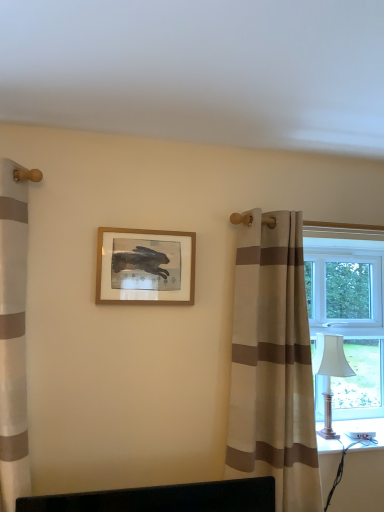
Find the location of a particular element. The image size is (384, 512). wooden picture frame at center is located at coordinates (145, 267).

Describe the element at coordinates (349, 310) in the screenshot. The width and height of the screenshot is (384, 512). I see `white plastic window at right` at that location.

The width and height of the screenshot is (384, 512). What are the coordinates of `wooden picture frame at center` in the screenshot? It's located at (145, 267).

From a real-world perspective, is wooden picture frame at center positioned over beige striped curtain at right based on gravity?

Yes.

From the image's perspective, between wooden picture frame at center and beige striped curtain at right, which one is located above?

wooden picture frame at center.

Which object is more forward, wooden picture frame at center or beige striped curtain at right?

beige striped curtain at right is more forward.

Relative to white plastic window at right, is wooden picture frame at center in front or behind?

In the image, wooden picture frame at center appears in front of white plastic window at right.

Considering the sizes of wooden picture frame at center and white plastic window at right in the image, is wooden picture frame at center bigger or smaller than white plastic window at right?

Clearly, wooden picture frame at center is smaller in size than white plastic window at right.

Considering the relative positions of wooden picture frame at center and white plastic window at right in the image provided, is wooden picture frame at center to the right of white plastic window at right from the viewer's perspective?

Incorrect, wooden picture frame at center is not on the right side of white plastic window at right.

From the image's perspective, which is above, wooden picture frame at center or white plastic window at right?

wooden picture frame at center, from the image's perspective.

Which object is thinner, wooden picture frame at center or silver metallic table lamp at right?

With smaller width is wooden picture frame at center.

Is wooden picture frame at center in front of or behind silver metallic table lamp at right in the image?

Visually, wooden picture frame at center is located in front of silver metallic table lamp at right.

Which of these two, wooden picture frame at center or silver metallic table lamp at right, is smaller?

wooden picture frame at center.

Can you confirm if wooden picture frame at center is positioned to the right of silver metallic table lamp at right?

No, wooden picture frame at center is not to the right of silver metallic table lamp at right.

From the image's perspective, which one is positioned higher, white plastic window at right or wooden picture frame at center?

wooden picture frame at center appears higher in the image.

Identify the location of picture frame above the white plastic window at right (from the image's perspective). (145, 267).

Is white plastic window at right turned away from wooden picture frame at center?

white plastic window at right does not have its back to wooden picture frame at center.

Is white plastic window at right outside of wooden picture frame at center?

white plastic window at right lies outside wooden picture frame at center's area.

Considering the positions of objects silver metallic table lamp at right and wooden picture frame at center in the image provided, who is more to the right, silver metallic table lamp at right or wooden picture frame at center?

From the viewer's perspective, silver metallic table lamp at right appears more on the right side.

Is silver metallic table lamp at right positioned beyond the bounds of wooden picture frame at center?

Yes.

From a real-world perspective, which object rests below the other?

From a 3D spatial view, silver metallic table lamp at right is below.

Which object is closer to the camera, silver metallic table lamp at right or wooden picture frame at center?

wooden picture frame at center is in front.

Consider the image. Which is correct: beige striped curtain at right is inside wooden picture frame at center, or outside of it?

beige striped curtain at right is located beyond the bounds of wooden picture frame at center.

Does beige striped curtain at right turn towards wooden picture frame at center?

No, beige striped curtain at right is not turned towards wooden picture frame at center.

From the image's perspective, is beige striped curtain at right positioned above or below wooden picture frame at center?

Clearly, from the image's perspective, beige striped curtain at right is below wooden picture frame at center.

Is beige striped curtain at right with wooden picture frame at center?

They are not placed beside each other.

Is white plastic window at right next to silver metallic table lamp at right?

No, white plastic window at right is not in contact with silver metallic table lamp at right.

Is point (325, 384) more distant than point (325, 430)?

Yes, point (325, 384) is behind point (325, 430).

Who is bigger, white plastic window at right or silver metallic table lamp at right?

white plastic window at right.

Where is `window above the silver metallic table lamp at right (from the image's perspective)`? This screenshot has height=512, width=384. window above the silver metallic table lamp at right (from the image's perspective) is located at coordinates (349, 310).

This screenshot has width=384, height=512. In order to click on curtain in front of the wooden picture frame at center in this screenshot , I will do `click(273, 364)`.

This screenshot has width=384, height=512. What are the coordinates of `window behind the wooden picture frame at center` in the screenshot? It's located at (349, 310).

Based on their spatial positions, is silver metallic table lamp at right or white plastic window at right closer to wooden picture frame at center?

white plastic window at right is closer to wooden picture frame at center.

From the image, which object appears to be nearer to silver metallic table lamp at right, white plastic window at right or beige striped curtain at right?

white plastic window at right is closer to silver metallic table lamp at right.

Considering their positions, is beige striped curtain at right positioned further to wooden picture frame at center than silver metallic table lamp at right?

silver metallic table lamp at right lies further to wooden picture frame at center than the other object.

Which object lies nearer to the anchor point wooden picture frame at center, white plastic window at right or silver metallic table lamp at right?

Based on the image, white plastic window at right appears to be nearer to wooden picture frame at center.

When comparing their distances from silver metallic table lamp at right, does wooden picture frame at center or white plastic window at right seem closer?

white plastic window at right lies closer to silver metallic table lamp at right than the other object.

Considering their positions, is white plastic window at right positioned closer to beige striped curtain at right than wooden picture frame at center?

The object closer to beige striped curtain at right is wooden picture frame at center.

From the image, which object appears to be farther from white plastic window at right, silver metallic table lamp at right or wooden picture frame at center?

wooden picture frame at center is further to white plastic window at right.

From the image, which object appears to be nearer to silver metallic table lamp at right, wooden picture frame at center or beige striped curtain at right?

beige striped curtain at right is closer to silver metallic table lamp at right.

Where is `table lamp between beige striped curtain at right and white plastic window at right along the z-axis`? The height and width of the screenshot is (512, 384). table lamp between beige striped curtain at right and white plastic window at right along the z-axis is located at coordinates (329, 373).

Locate an element on the screen. This screenshot has height=512, width=384. curtain located between wooden picture frame at center and white plastic window at right in the left-right direction is located at coordinates (273, 364).

Locate an element on the screen. The width and height of the screenshot is (384, 512). curtain situated between wooden picture frame at center and silver metallic table lamp at right from left to right is located at coordinates click(273, 364).

Find the location of `table lamp between wooden picture frame at center and white plastic window at right`. table lamp between wooden picture frame at center and white plastic window at right is located at coordinates (329, 373).